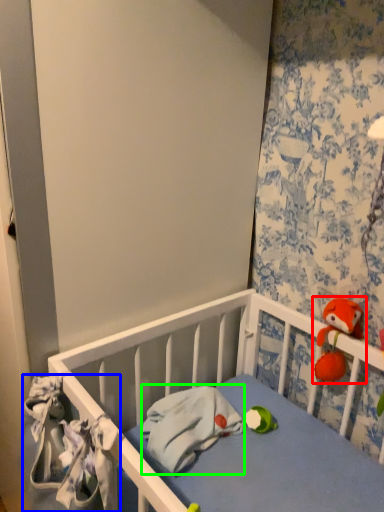
Question: Which object is positioned closest to toy (highlighted by a red box)? Select from material (highlighted by a blue box) and material (highlighted by a green box).

Choices:
 (A) material
 (B) material

Answer: (B)